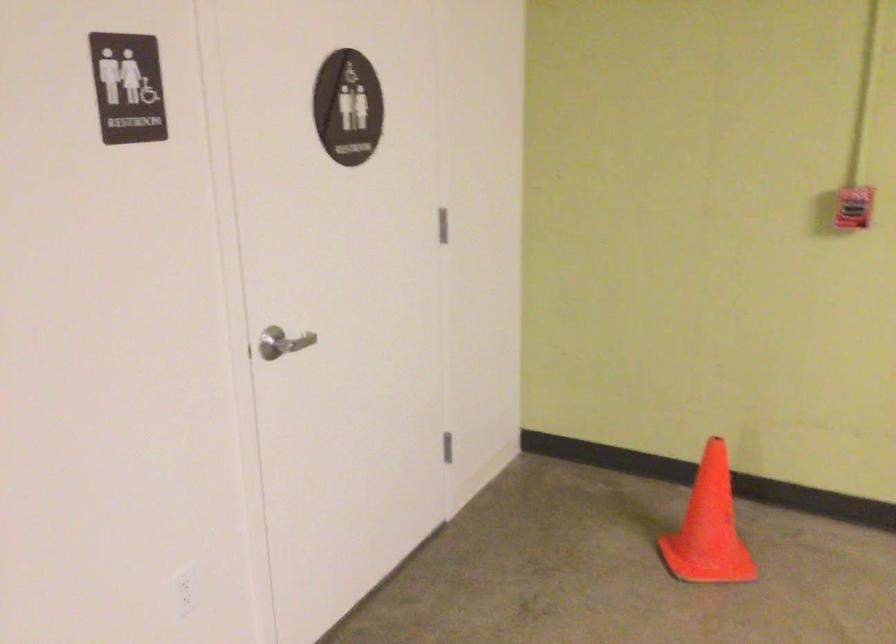
Locate an element on the screen. The height and width of the screenshot is (644, 896). orange traffic cone is located at coordinates (709, 527).